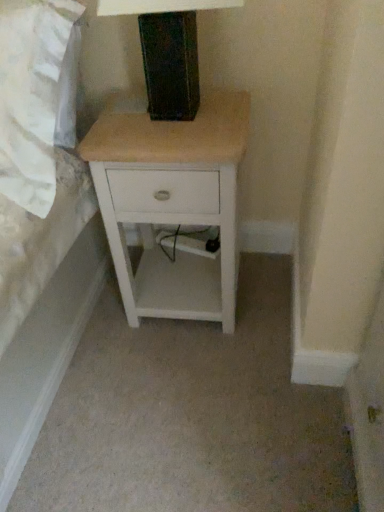
Image resolution: width=384 pixels, height=512 pixels. I want to click on space that is in front of white wood nightstand at center, so click(195, 381).